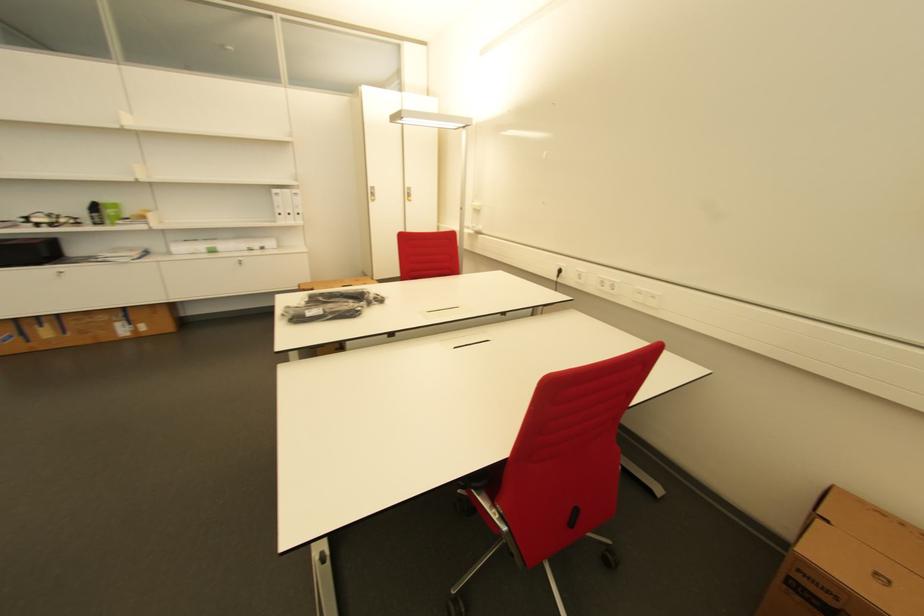
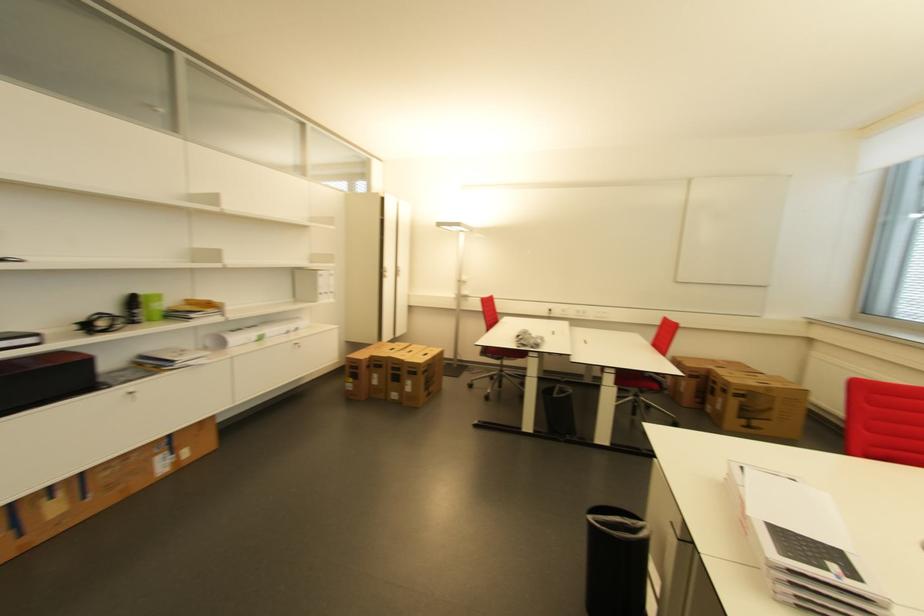
Find the pixel in the second image that matches point (104, 208) in the first image.

(147, 301)